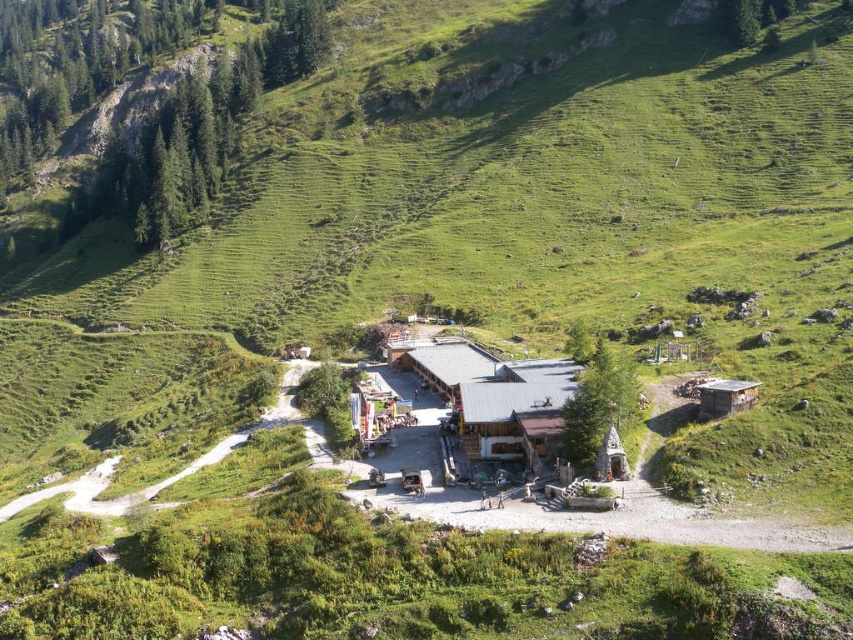
You are planning to set up a tent between the brown wooden hut at center and the wooden cabin at right. Based on their positions, which structure should you place your tent closer to if you want it to be on the left side of the cabin?

You should place your tent closer to the brown wooden hut at center because it is positioned on the left side of the wooden cabin at right, so the tent would naturally be on the left side of the cabin if placed near the hut.